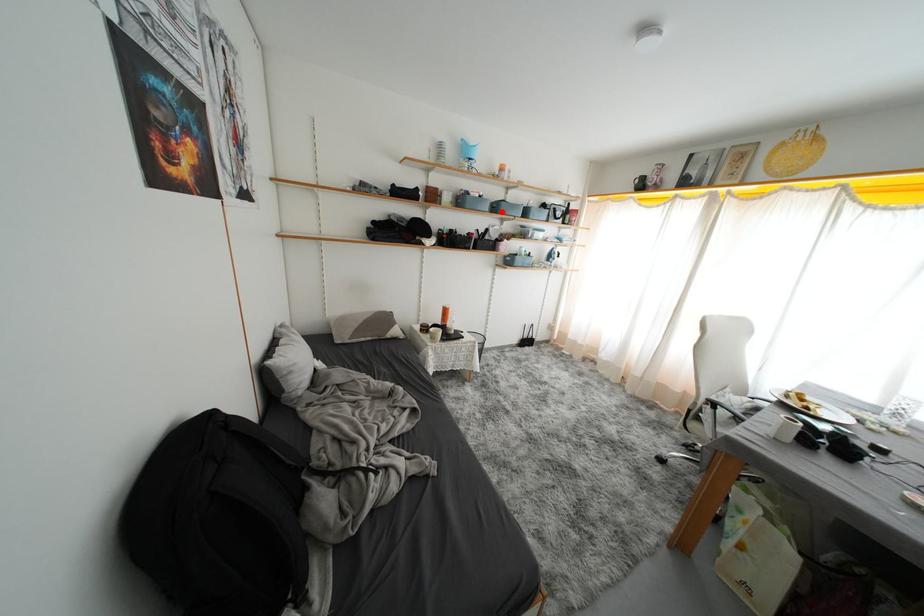
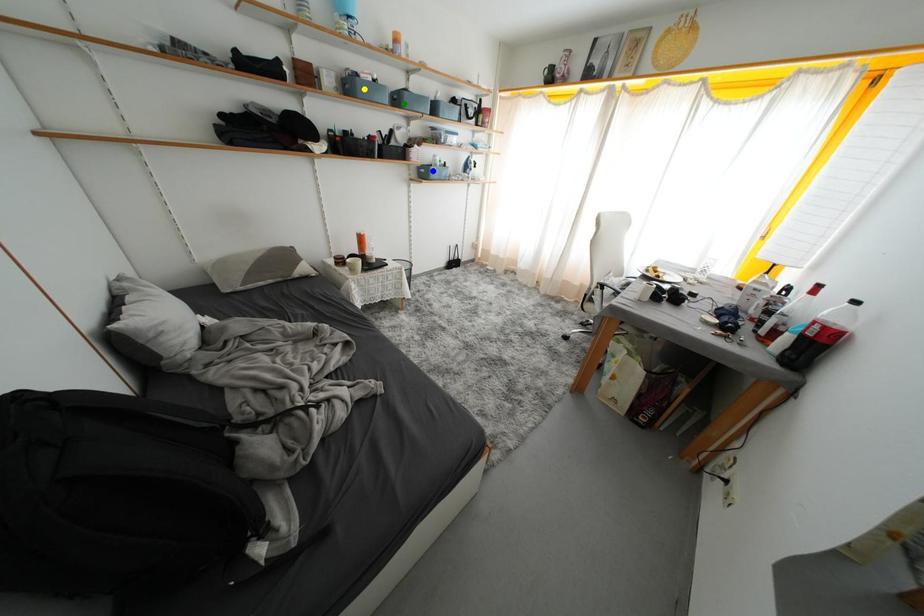
Question: I am providing you with two images of the same scene from different viewpoints. A red point is marked on the first image. You are given multiple points on the second image. Which spot in image 2 lines up with the point in image 1?

Choices:
 (A) blue point
 (B) yellow point
 (C) green point

Answer: (C)